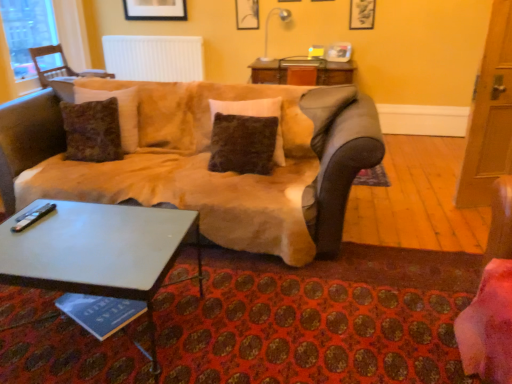
At what (x,y) coordinates should I click in order to perform the action: click on unoccupied region to the right of white glossy coffee table at lower left. Please return your answer as a coordinate pair (x, y). Looking at the image, I should click on (250, 315).